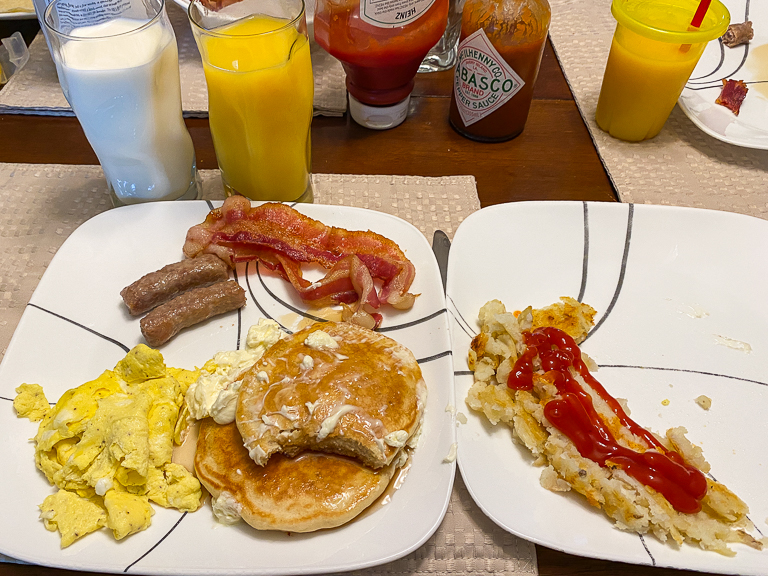
This screenshot has width=768, height=576. What are the coordinates of `cups` in the screenshot? It's located at (117, 92), (250, 79), (657, 56).